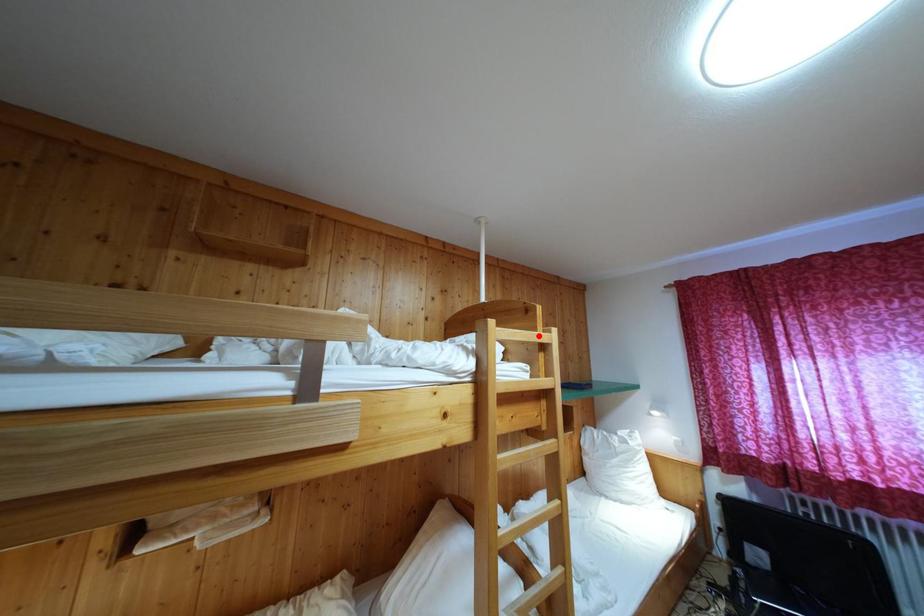
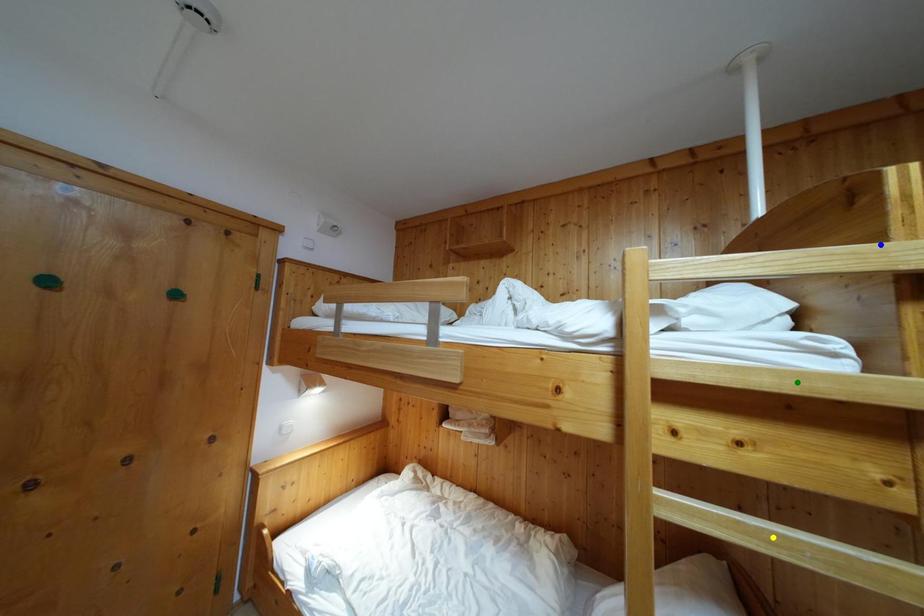
Question: I am providing you with two images of the same scene from different viewpoints. A red point is marked on the first image. You are given multiple points on the second image. Which point in image 2 is actually the same real-world point as the red point in image 1?

Choices:
 (A) yellow point
 (B) green point
 (C) blue point

Answer: (C)